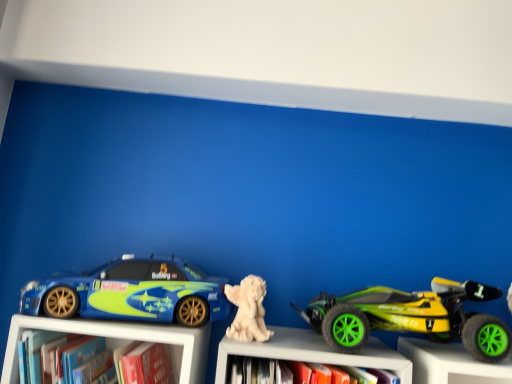
What are the coordinates of `vacant area that lies to the right of white matte statue at center, the 2th toy when ordered from right to left` in the screenshot? It's located at (315, 340).